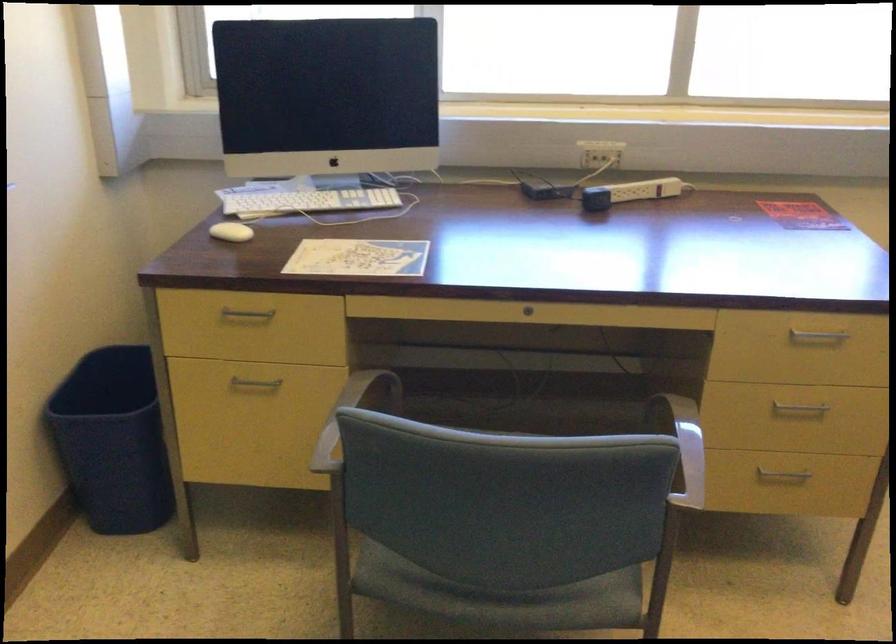
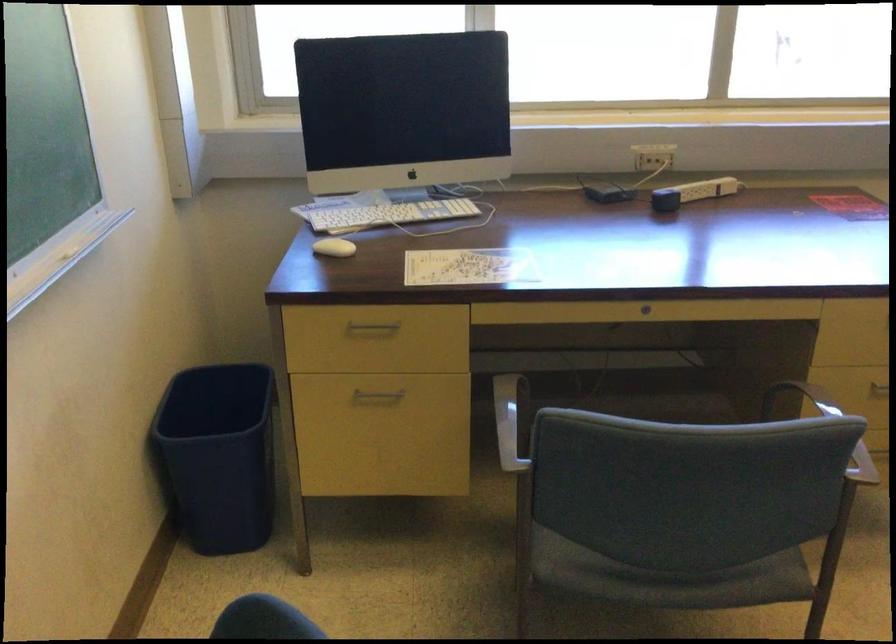
Find the pixel in the second image that matches pixel 631 196 in the first image.

(692, 193)